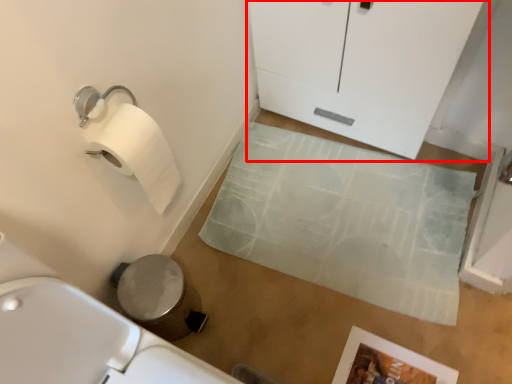
Question: From the image's perspective, considering the relative positions of glass door (annotated by the red box) and bath mat in the image provided, where is glass door (annotated by the red box) located with respect to the staircase?

Choices:
 (A) below
 (B) above

Answer: (B)